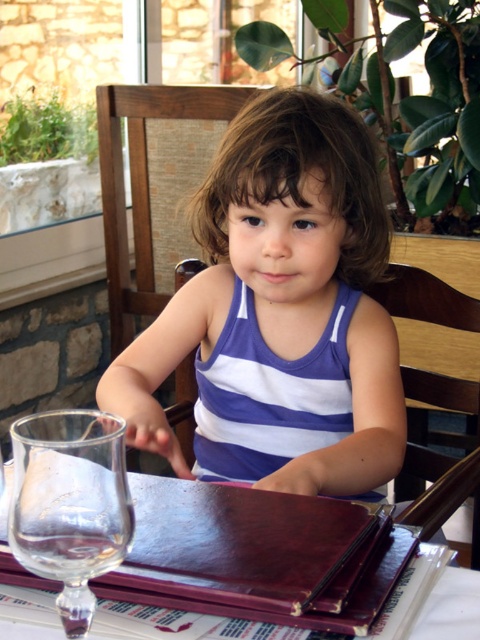
Does purple striped tank top at center have a smaller size compared to transparent glass at lower left?

No.

Can you confirm if purple striped tank top at center is thinner than transparent glass at lower left?

No, purple striped tank top at center is not thinner than transparent glass at lower left.

Is point (380, 260) positioned behind point (85, 451)?

Yes, point (380, 260) is farther from viewer.

You are a GUI agent. You are given a task and a screenshot of the screen. Output one action in this format:
    pyautogui.click(x=<x>, y=<y>)
    Task: Click on the purple striped tank top at center
    
    Given the screenshot: What is the action you would take?
    pyautogui.click(x=284, y=285)

Describe the element at coordinates (284, 285) in the screenshot. This screenshot has width=480, height=640. I see `purple striped tank top at center` at that location.

Which of these two, purple striped tank top at center or brown leather menu at center, stands shorter?

With less height is brown leather menu at center.

Is point (257, 118) farther from viewer compared to point (310, 502)?

Yes.

The width and height of the screenshot is (480, 640). In order to click on purple striped tank top at center in this screenshot , I will do `click(284, 285)`.

Is transparent glass at lower left bigger than brown leather menu at center?

No, transparent glass at lower left is not bigger than brown leather menu at center.

This screenshot has height=640, width=480. What do you see at coordinates (70, 504) in the screenshot?
I see `transparent glass at lower left` at bounding box center [70, 504].

Where is `transparent glass at lower left`? The image size is (480, 640). transparent glass at lower left is located at coordinates (70, 504).